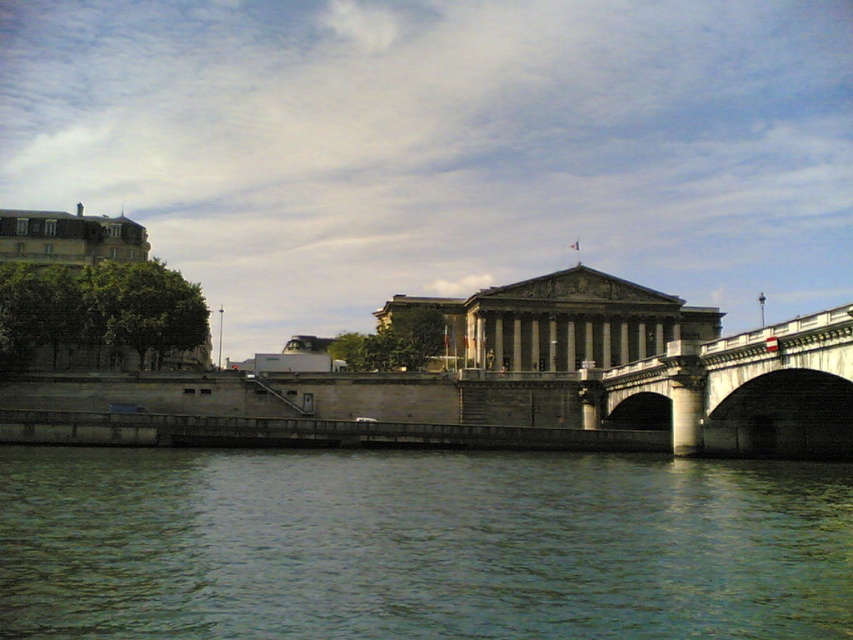
Question: Observing the image, what is the correct spatial positioning of greenish water at lower center in reference to stone bridge at center?

Choices:
 (A) above
 (B) below

Answer: (B)

Question: Does greenish water at lower center have a larger size compared to stone bridge at center?

Choices:
 (A) yes
 (B) no

Answer: (A)

Question: Does greenish water at lower center appear on the left side of stone bridge at center?

Choices:
 (A) yes
 (B) no

Answer: (A)

Question: Which point is farther from the camera taking this photo?

Choices:
 (A) pos(772,339)
 (B) pos(357,516)

Answer: (A)